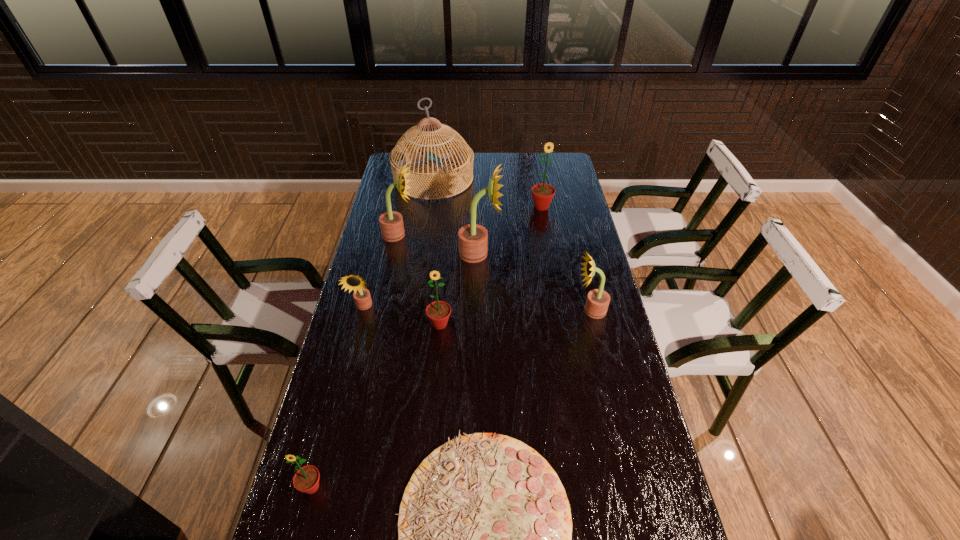
This screenshot has width=960, height=540. I want to click on free space that satisfies the following two spatial constraints: 1. on the face of the rightmost object; 2. on the face of the second biggest green sunflower, so click(594, 324).